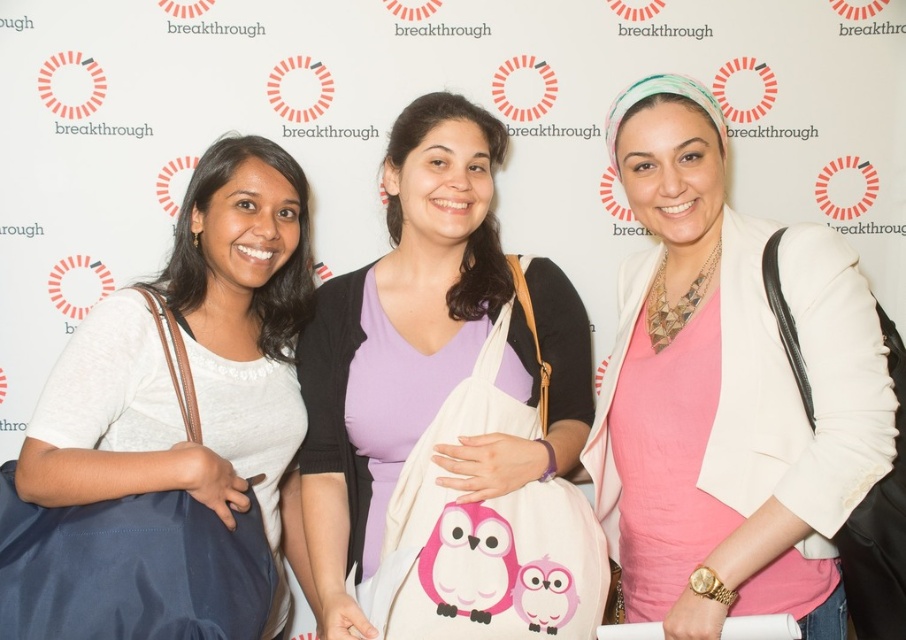
You are a photographer setting up for a group photo. You notice the pink fabric bag at center and the black leather bag at right. Which bag should you adjust to ensure both bags are at eye level for the camera? Explain your reasoning.

The pink fabric bag at center is taller than the black leather bag at right. To ensure both bags are at eye level, you should lower the pink fabric bag at center so that its height matches the black leather bag at right.

You are a photographer at the event and need to ensure that both the pink matte shirt at center and the black leather bag at right are clearly visible in the photo. Given their sizes, which one might require more careful framing to avoid being too small in the shot?

The black leather bag at right is smaller in size than the pink matte shirt at center, so it might require more careful framing to ensure it isn not too small in the photo.